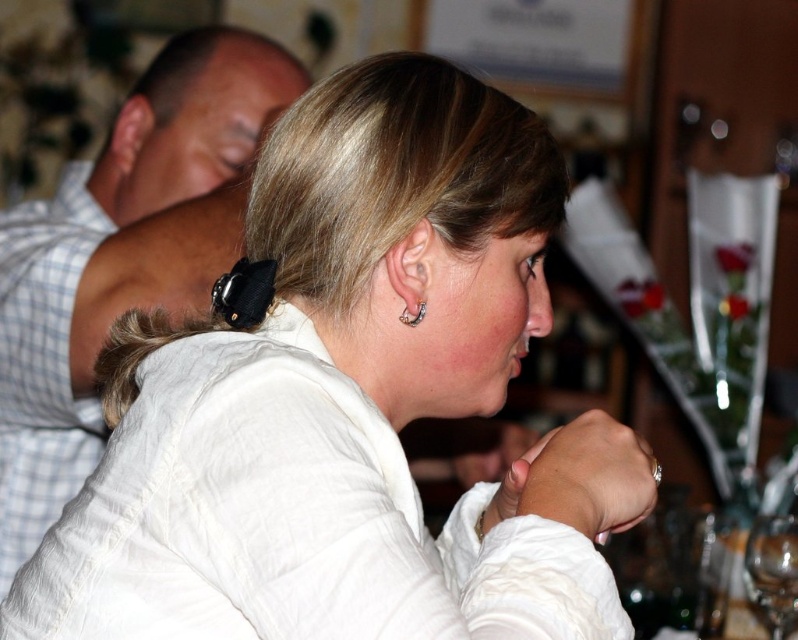
Question: Which point is farther from the camera taking this photo?

Choices:
 (A) (119, 358)
 (B) (44, 339)

Answer: (B)

Question: Can you confirm if white checkered fabric at upper left is positioned below transparent glass at lower right?

Choices:
 (A) no
 (B) yes

Answer: (A)

Question: Which object is the farthest from the white checkered fabric at upper left?

Choices:
 (A) transparent glass at lower right
 (B) brown fuzzy hair at upper left
 (C) white checkered shirt at upper left
 (D) silver metallic earring at ear

Answer: (A)

Question: In this image, where is white checkered shirt at upper left located relative to brown fuzzy hair at upper left?

Choices:
 (A) right
 (B) left

Answer: (B)

Question: Where is transparent glass at lower right located in relation to silver metallic earring at ear in the image?

Choices:
 (A) below
 (B) above

Answer: (A)

Question: Which of the following is the closest to the observer?

Choices:
 (A) brown fuzzy hair at upper left
 (B) white checkered shirt at upper left
 (C) silver metallic earring at ear

Answer: (A)